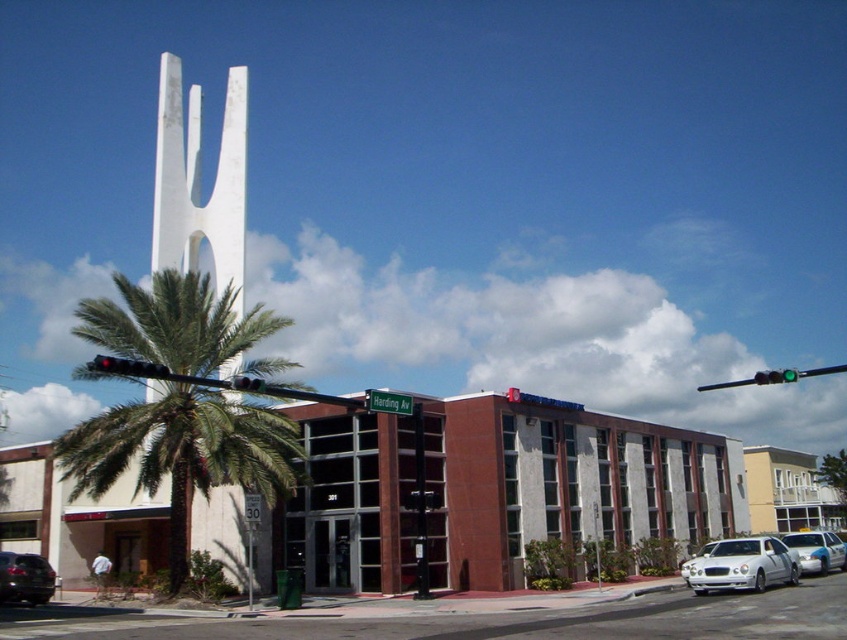
You are standing at the entrance of the building and want to take a photo of Harding Av street sign. You have two points marked on your camera screen at coordinates point (87, 307) and point (136, 372). Which point should you focus on to ensure the street sign is in focus?

You should focus on point (87, 307) because it is closer to the camera and the street sign is likely at that distance.

You are standing at the entrance of the building and want to take a photo of the green leafy palm tree at left. Based on its coordinates, which direction should you face to capture it in your shot?

The green leafy palm tree at left is located at coordinates point (x=183, y=452), which means it is positioned to the right side of the scene. Therefore, you should turn slightly to your right to face the palm tree and capture it in your photo.

You are a delivery driver who needs to park your vehicle in this area. The parking spot you want is 70 feet long. You see the matte black suv at lower left and the blue metallic sedan at center. Can your vehicle fit between them without overlapping either car?

The distance between the matte black suv at lower left and the blue metallic sedan at center is 69.02 feet. Since the parking spot is 70 feet long, your vehicle cannot fit between them as the available space is slightly shorter than required.